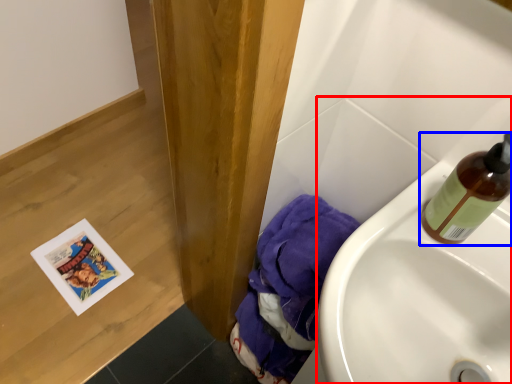
Question: Which point is closer to the camera, sink (highlighted by a red box) or bottle (highlighted by a blue box)?

Choices:
 (A) sink
 (B) bottle

Answer: (A)